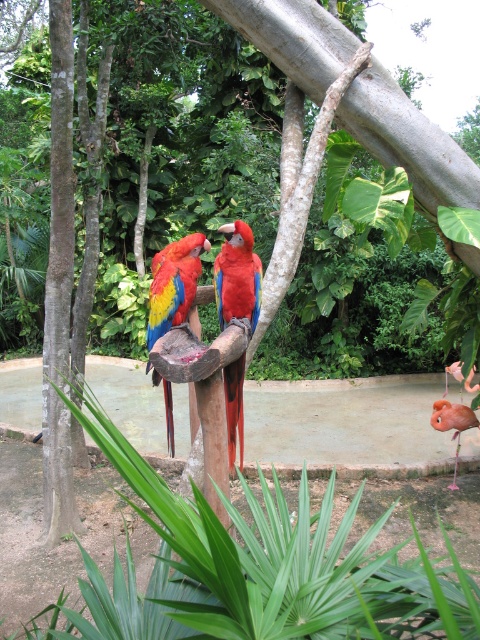
You are a bird trainer observing two parrots in an aviary. You notice the shiny red parrot at center and the shiny multicolored parrot at center. Which of these two parrots is larger in size?

The shiny red parrot at center is bigger than the shiny multicolored parrot at center.

You are a birdwatcher observing the scene. You notice the shiny red parrot at center and the matte pink flamingo at lower right. Which bird is taller?

The shiny red parrot at center is much taller than the matte pink flamingo at lower right.